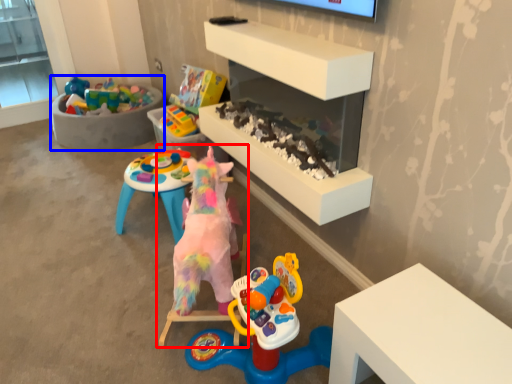
Question: Which object is closer to the camera taking this photo, toy (highlighted by a red box) or furniture (highlighted by a blue box)?

Choices:
 (A) toy
 (B) furniture

Answer: (A)